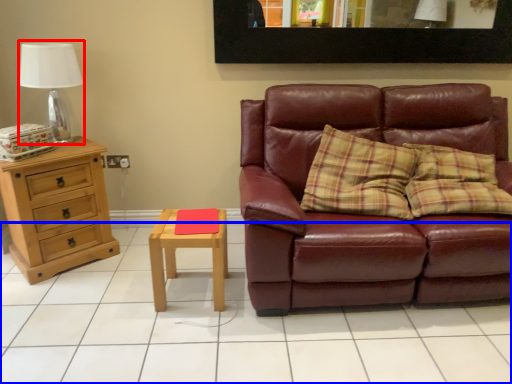
Question: Among these objects, which one is nearest to the camera, table lamp (highlighted by a red box) or tile (highlighted by a blue box)?

Choices:
 (A) table lamp
 (B) tile

Answer: (B)